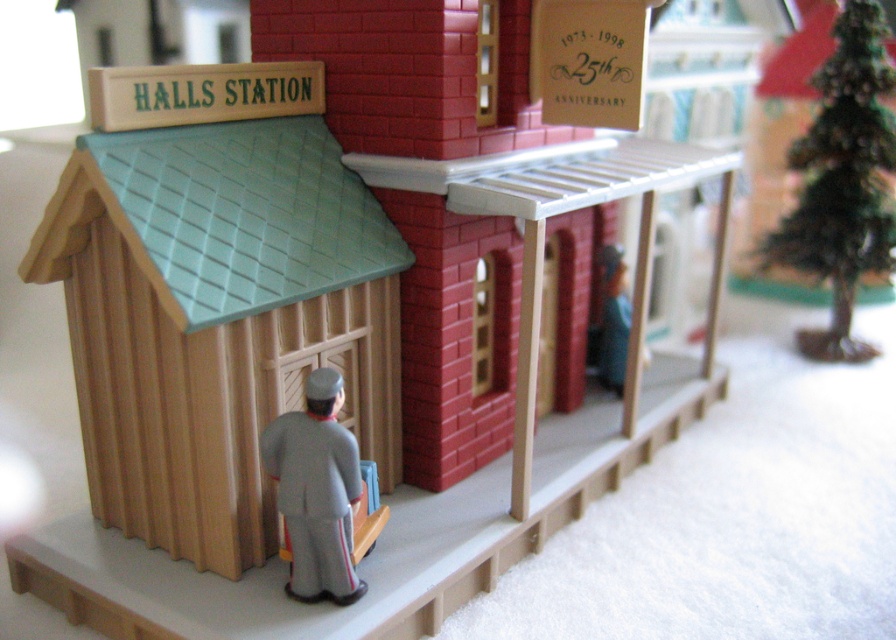
You are a visitor at Halls Station and want to take a photo of both the green matte christmas tree at right and the gray fabric uniform at center. Can you stand in a position where both are visible in the same frame?

The green matte christmas tree at right is located above the gray fabric uniform at center, so yes, you can stand in a position where both are visible in the same frame as they are vertically aligned with the tree above the uniform.

You are a visitor at Halls Station and want to take a photo of both the green matte christmas tree at right and the gray fabric uniform at center in the same frame. Given that your camera has a maximum focus range of 5 feet, will you be able to capture both objects in one shot?

The green matte christmas tree at right and gray fabric uniform at center are 4.75 feet apart from each other, so yes, you can capture both in one shot as the distance is within the camera focus range of 5 feet.